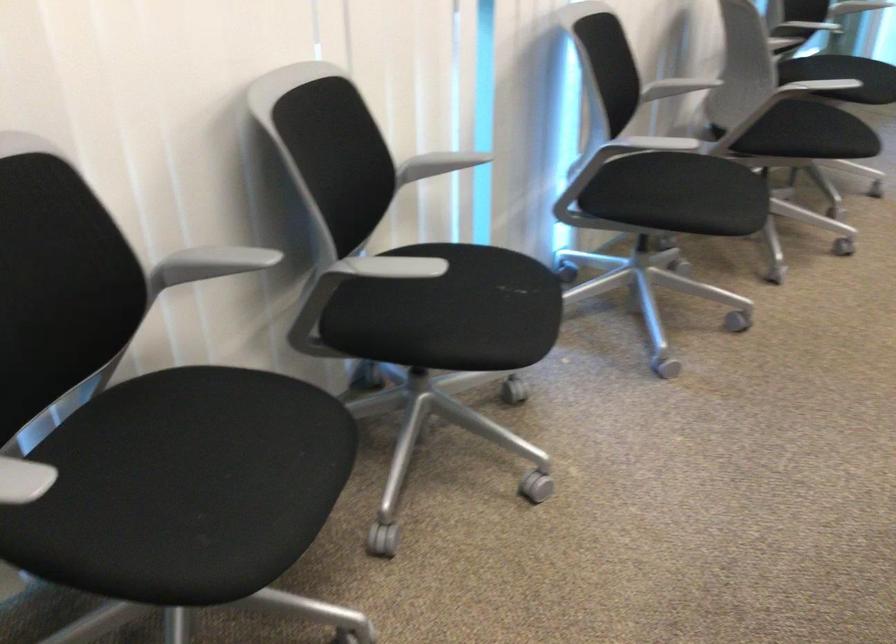
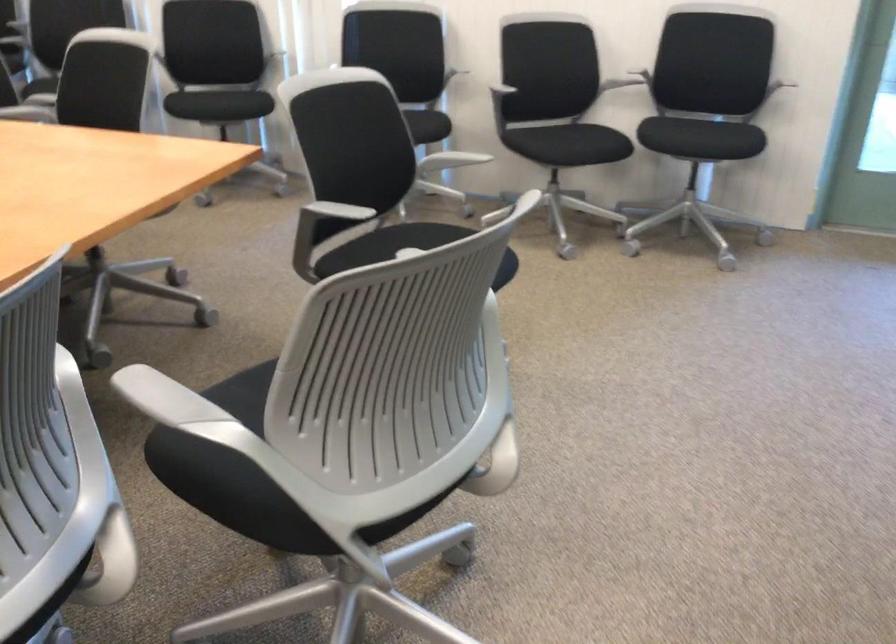
Question: I am providing you with two images of the same scene from different viewpoints. Please identify which objects are invisible in image2.

Choices:
 (A) gray chair armrest
 (B) pink organizer basket
 (C) gray adjustment knob
 (D) black chair sitting surface

Answer: (D)